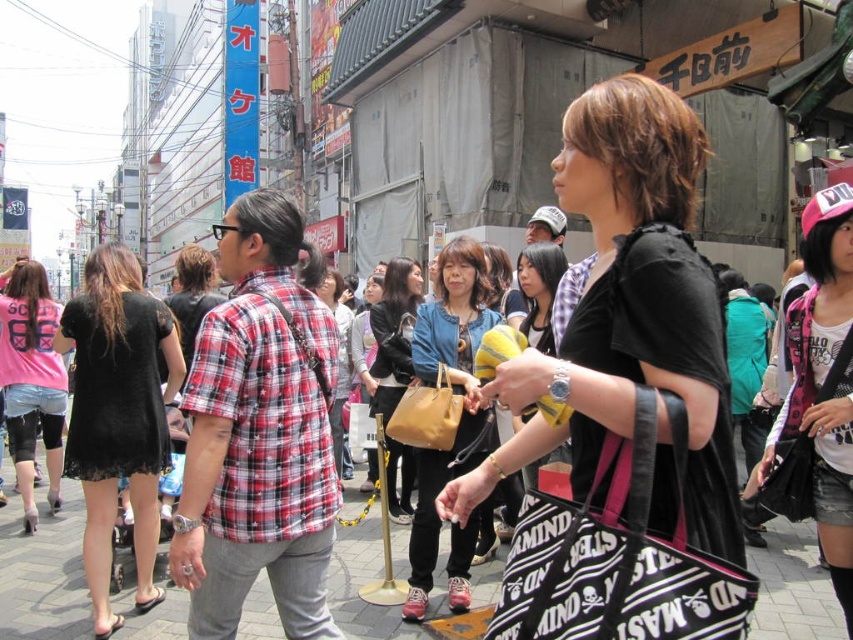
Question: Which of the following is the farthest from the observer?

Choices:
 (A) (428, 442)
 (B) (849, 269)

Answer: (A)

Question: Which point is farther from the camera taking this photo?

Choices:
 (A) (641, 493)
 (B) (401, 440)
 (C) (387, 474)

Answer: (C)

Question: Can you confirm if pink matte shirt at center is positioned above matte brown handbag at center?

Choices:
 (A) yes
 (B) no

Answer: (A)

Question: Which object is positioned farthest from the matte brown handbag at center?

Choices:
 (A) black fabric bag at center
 (B) matte yellow handbag at center

Answer: (A)

Question: Considering the relative positions of matte black jacket at center and plaid shirt at center in the image provided, where is matte black jacket at center located with respect to plaid shirt at center?

Choices:
 (A) left
 (B) right

Answer: (B)

Question: Is pink matte shirt at center below plaid shirt at center?

Choices:
 (A) yes
 (B) no

Answer: (B)